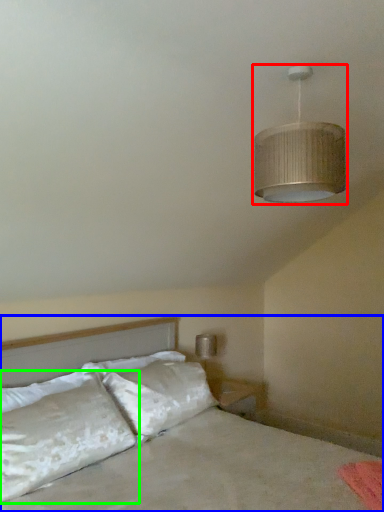
Question: Estimate the real-world distances between objects in this image. Which object is closer to lamp (highlighted by a red box), bed (highlighted by a blue box) or pillow (highlighted by a green box)?

Choices:
 (A) bed
 (B) pillow

Answer: (A)